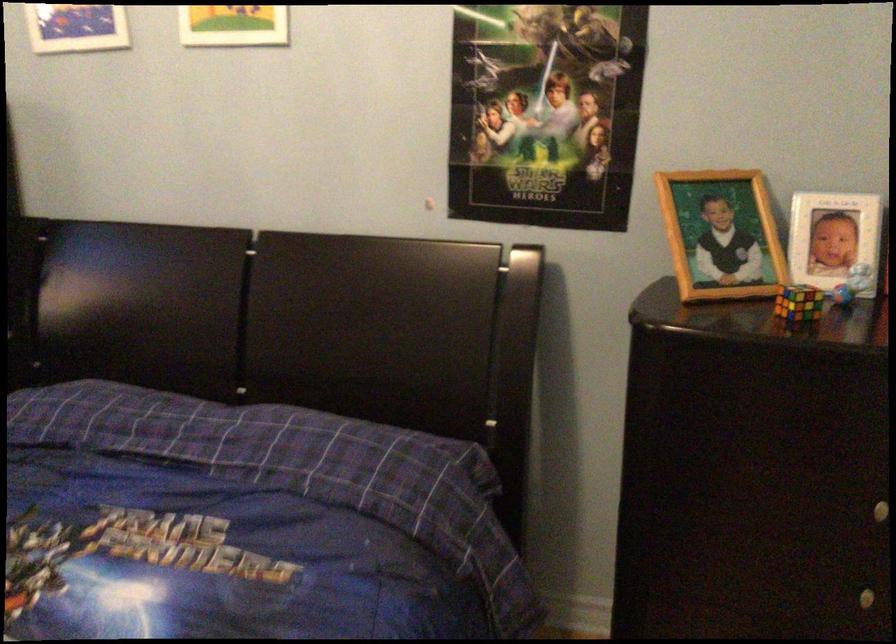
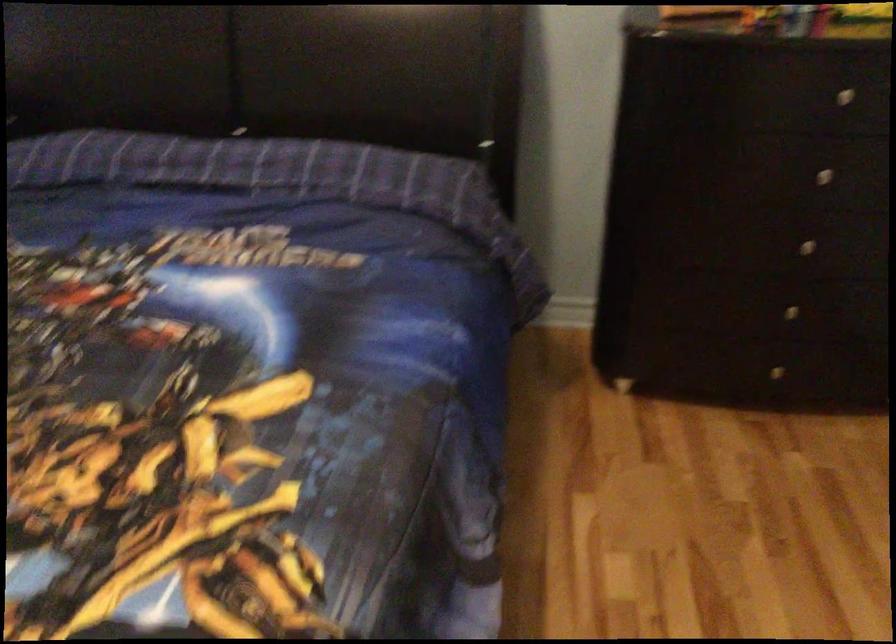
In a continuous first-person perspective shot, in which direction is the camera moving?

The cameraman walked toward left, backward.